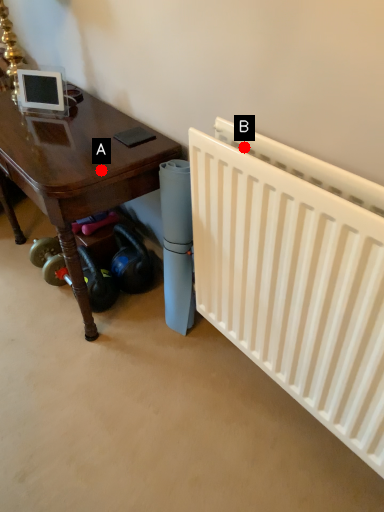
Question: Two points are circled on the image, labeled by A and B beside each circle. Which point is farther from the camera taking this photo?

Choices:
 (A) A is further
 (B) B is further

Answer: (A)